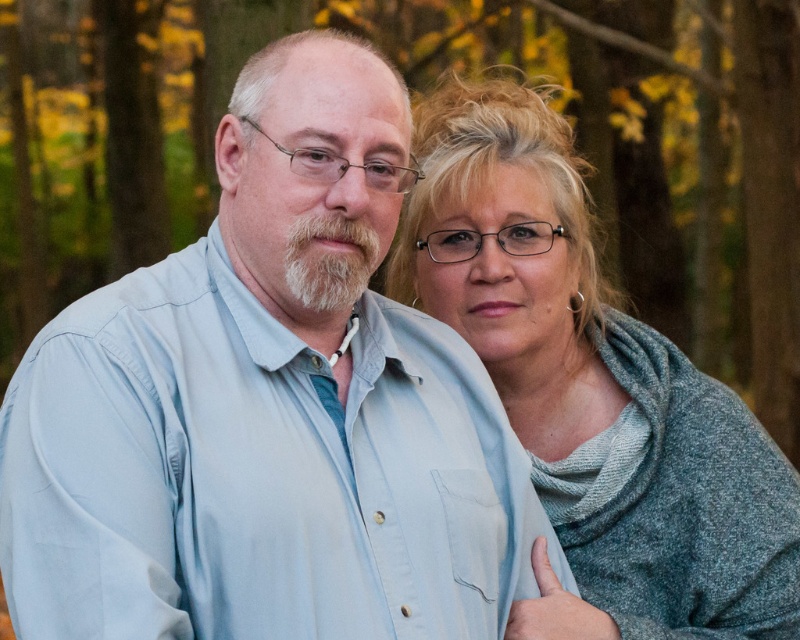
Question: Can you confirm if gray knit sweater at upper right is bigger than white fluffy beard at center?

Choices:
 (A) yes
 (B) no

Answer: (A)

Question: Which of the following is the farthest from the observer?

Choices:
 (A) (40, 540)
 (B) (350, 291)
 (C) (630, 589)

Answer: (C)

Question: Where is gray knit sweater at upper right located in relation to white fluffy beard at center in the image?

Choices:
 (A) above
 (B) below

Answer: (B)

Question: Based on their relative distances, which object is nearer to the white fluffy beard at center?

Choices:
 (A) light blue shirt at center
 (B) gray knit sweater at upper right

Answer: (A)

Question: Does gray knit sweater at upper right have a larger size compared to white fluffy beard at center?

Choices:
 (A) no
 (B) yes

Answer: (B)

Question: Which point appears farthest from the camera in this image?

Choices:
 (A) (637, 433)
 (B) (544, 520)

Answer: (A)